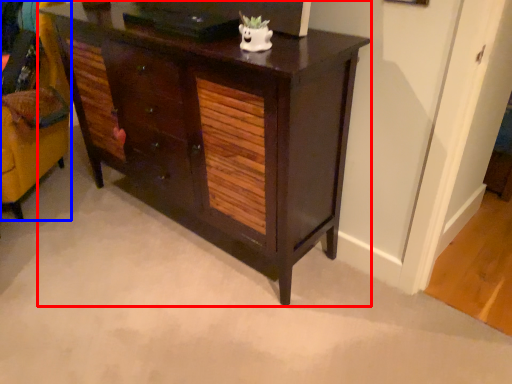
Question: Which object is further to the camera taking this photo, chest of drawers (highlighted by a red box) or swivel chair (highlighted by a blue box)?

Choices:
 (A) chest of drawers
 (B) swivel chair

Answer: (B)